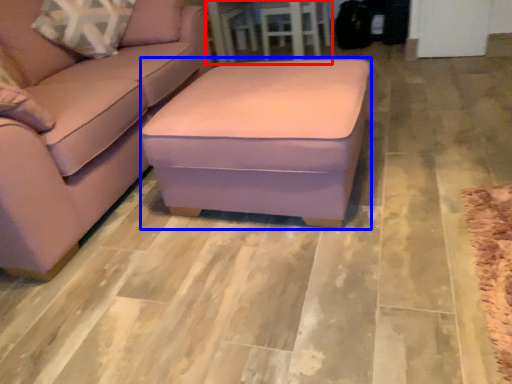
Question: Which object is further to the camera taking this photo, table (highlighted by a red box) or stool (highlighted by a blue box)?

Choices:
 (A) table
 (B) stool

Answer: (A)